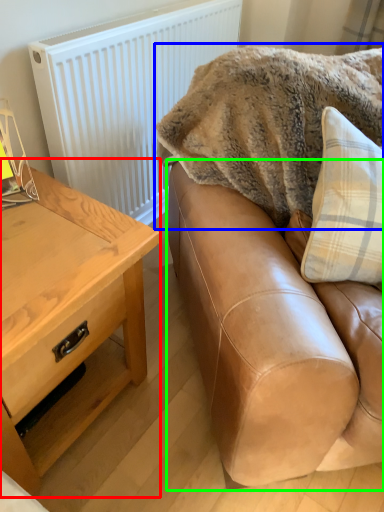
Question: Estimate the real-world distances between objects in this image. Which object is farther from table (highlighted by a red box), blanket (highlighted by a blue box) or studio couch (highlighted by a green box)?

Choices:
 (A) blanket
 (B) studio couch

Answer: (A)